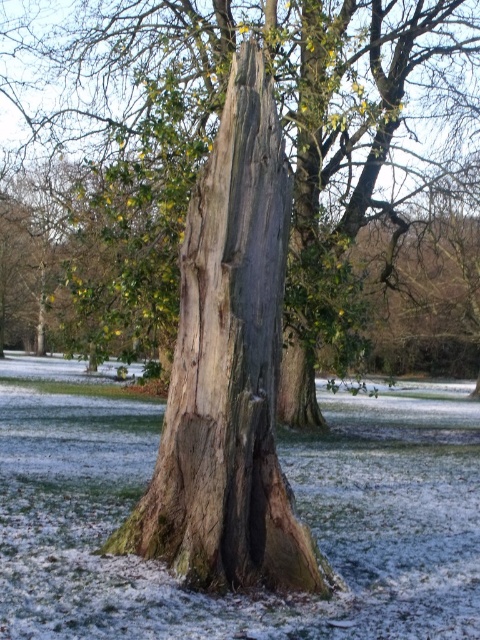
Question: Considering the relative positions of smooth bark tree trunk at center and weathered wood tree trunk at center in the image provided, where is smooth bark tree trunk at center located with respect to weathered wood tree trunk at center?

Choices:
 (A) below
 (B) above

Answer: (B)

Question: Is smooth bark tree trunk at center behind weathered wood tree trunk at center?

Choices:
 (A) yes
 (B) no

Answer: (A)

Question: Does smooth bark tree trunk at center appear over weathered wood tree trunk at center?

Choices:
 (A) yes
 (B) no

Answer: (A)

Question: Which object is closer to the camera taking this photo?

Choices:
 (A) weathered wood tree trunk at center
 (B) smooth bark tree trunk at center

Answer: (A)